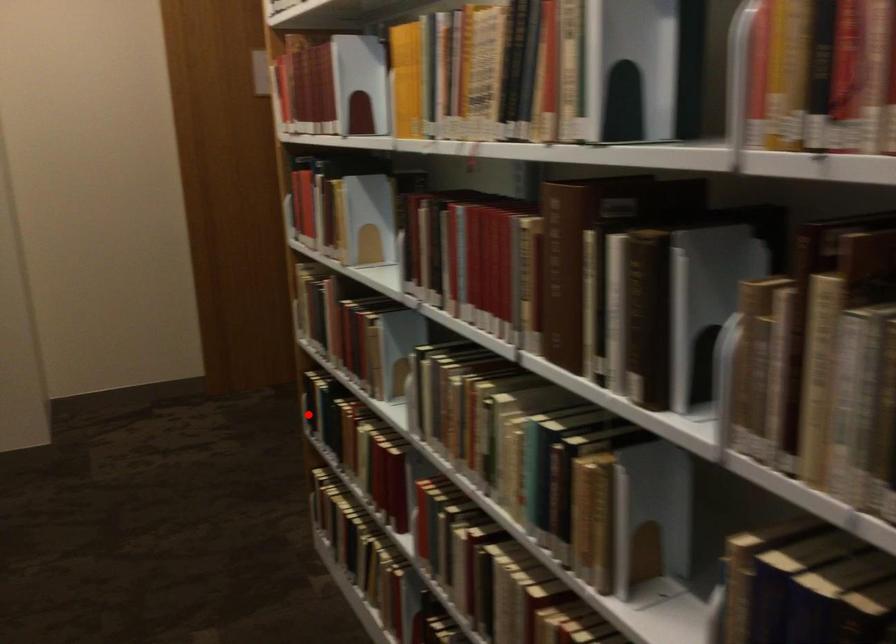
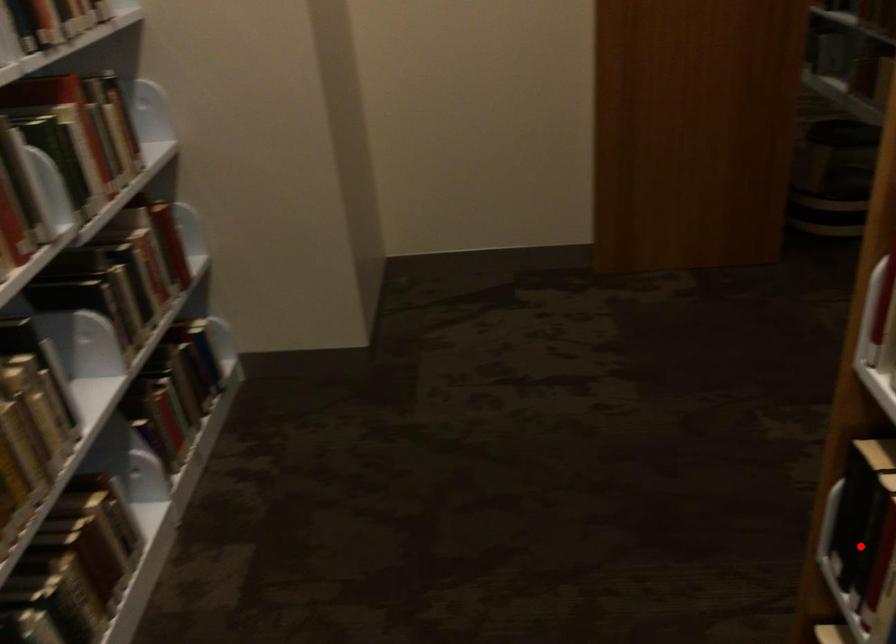
Based on the photo, I am providing you with two images of the same scene from different viewpoints. A red point is marked on the first image and another point is marked on the second image. Is the red point in image1 aligned with the point shown in image2?

Yes